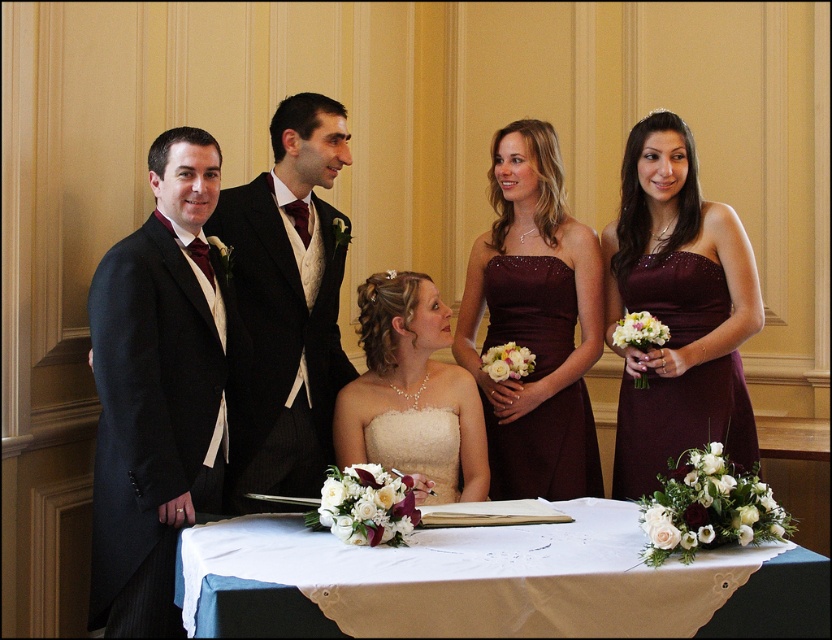
Question: Which object is the farthest from the shiny black suit at center?

Choices:
 (A) white cloth at center
 (B) burgundy satin dress at center
 (C) white satin dress at center

Answer: (A)

Question: Among these points, which one is farthest from the camera?

Choices:
 (A) (624, 452)
 (B) (580, 406)
 (C) (310, 403)
 (D) (696, 621)

Answer: (B)

Question: Is shiny black suit at center above burgundy satin dress at center?

Choices:
 (A) yes
 (B) no

Answer: (A)

Question: Which object is the farthest from the matte black suit at left?

Choices:
 (A) burgundy satin dress at right
 (B) white cloth at center

Answer: (A)

Question: Does white cloth at center have a greater width compared to white satin dress at center?

Choices:
 (A) no
 (B) yes

Answer: (B)

Question: Is white cloth at center below matte burgundy dress at center?

Choices:
 (A) no
 (B) yes

Answer: (B)